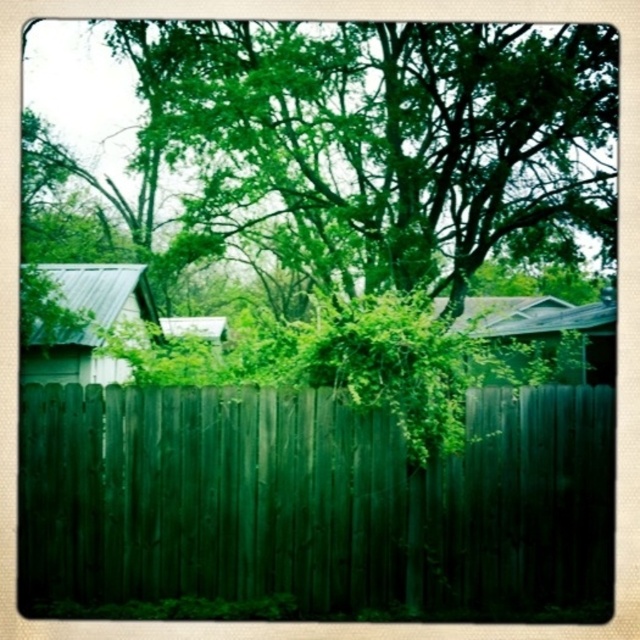
I want to click on metallic green hut at left, so click(90, 323).

You are a GUI agent. You are given a task and a screenshot of the screen. Output one action in this format:
    pyautogui.click(x=<x>, y=<y>)
    Task: Click on the metallic green hut at left
    The width and height of the screenshot is (640, 640).
    Given the screenshot: What is the action you would take?
    pyautogui.click(x=90, y=323)

What are the coordinates of `dark green wood fence at center` in the screenshot? It's located at (312, 499).

Between point (429, 525) and point (48, 362), which one is positioned in front?

Positioned in front is point (429, 525).

You are a GUI agent. You are given a task and a screenshot of the screen. Output one action in this format:
    pyautogui.click(x=<x>, y=<y>)
    Task: Click on the dark green wood fence at center
    The image size is (640, 640).
    Given the screenshot: What is the action you would take?
    pyautogui.click(x=312, y=499)

Does point (547, 412) come closer to viewer compared to point (484, 320)?

Yes, it is in front of point (484, 320).

Is point (28, 531) positioned behind point (541, 336)?

No, (28, 531) is closer to viewer.

Does point (51, 445) come in front of point (605, 337)?

Yes, point (51, 445) is closer to viewer.

You are a GUI agent. You are given a task and a screenshot of the screen. Output one action in this format:
    pyautogui.click(x=<x>, y=<y>)
    Task: Click on the dark green wood fence at center
    The height and width of the screenshot is (640, 640).
    Given the screenshot: What is the action you would take?
    pyautogui.click(x=312, y=499)